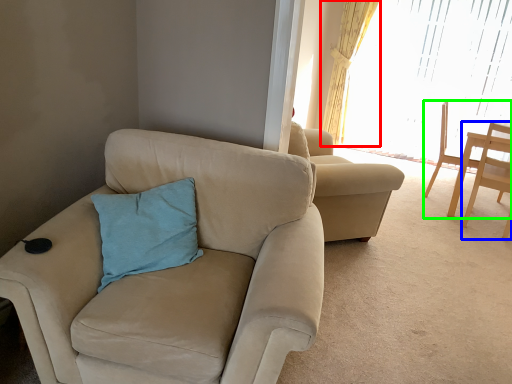
Question: Which object is the farthest from curtain (highlighted by a red box)? Choose among these: chair (highlighted by a blue box) or chair (highlighted by a green box).

Choices:
 (A) chair
 (B) chair

Answer: (A)